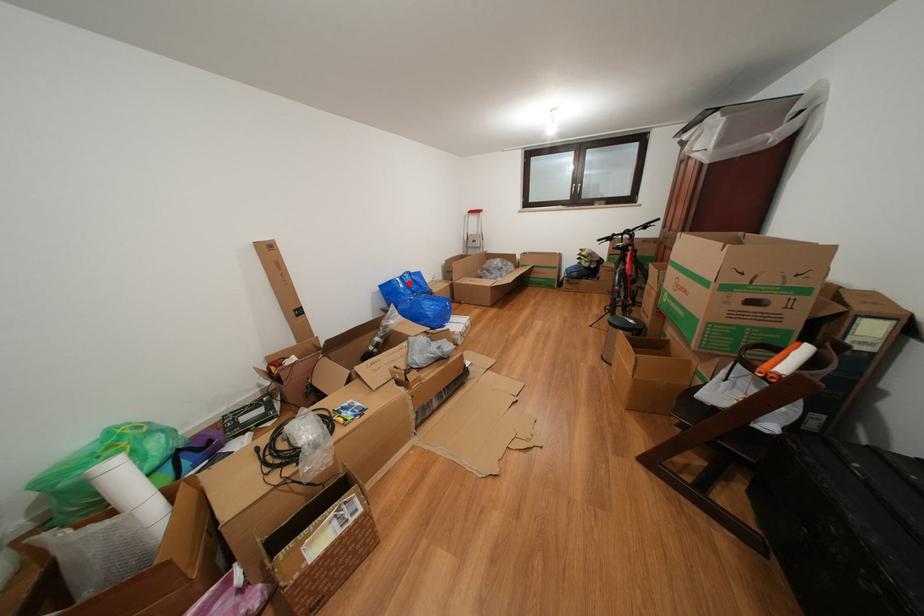
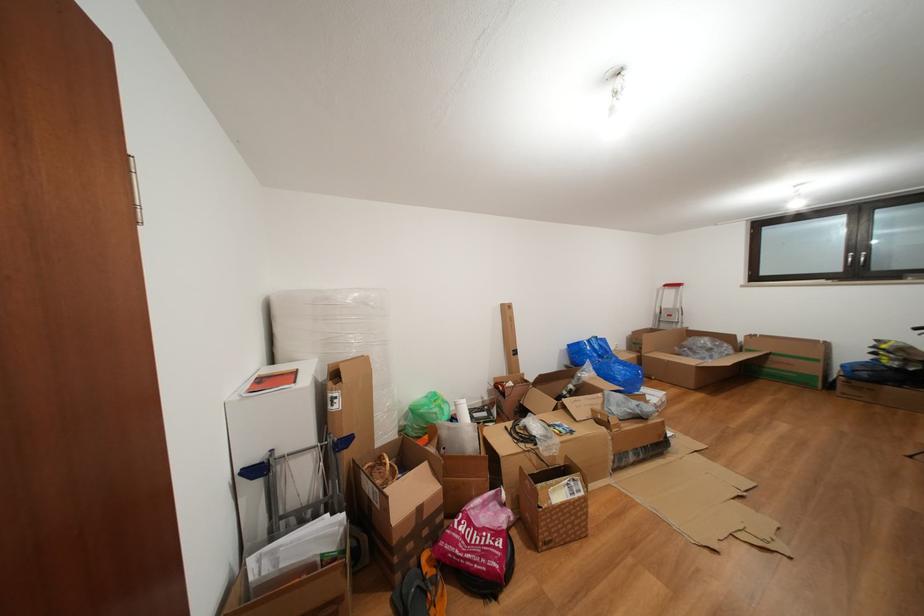
Locate, in the second image, the point that corresponds to the highlighted location in the first image.

(597, 346)